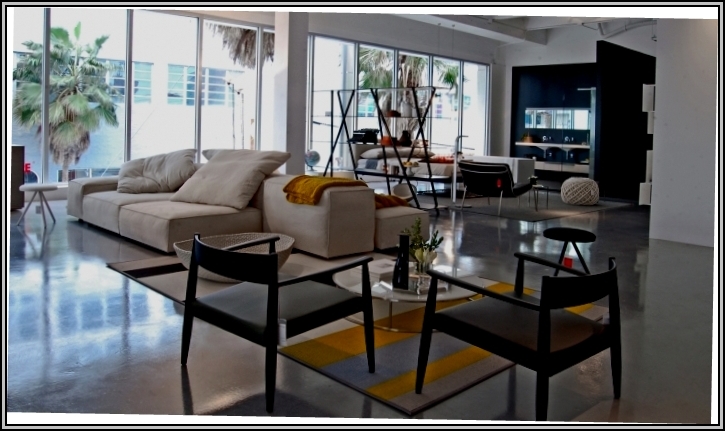
At what (x,y) coordinates should I click in order to perform the action: click on wall separator. Please return your answer as a coordinate pair (x, y). Looking at the image, I should click on (624, 95).